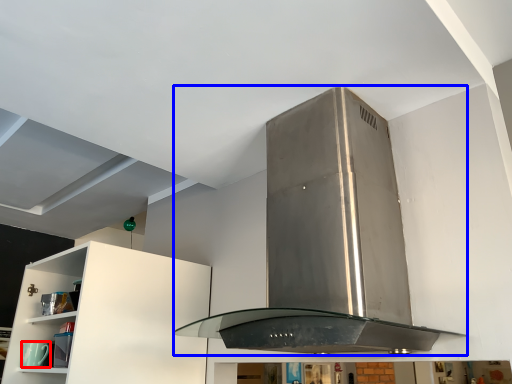
Question: Which of the following is the closest to the observer, appliance (highlighted by a red box) or home appliance (highlighted by a blue box)?

Choices:
 (A) appliance
 (B) home appliance

Answer: (B)